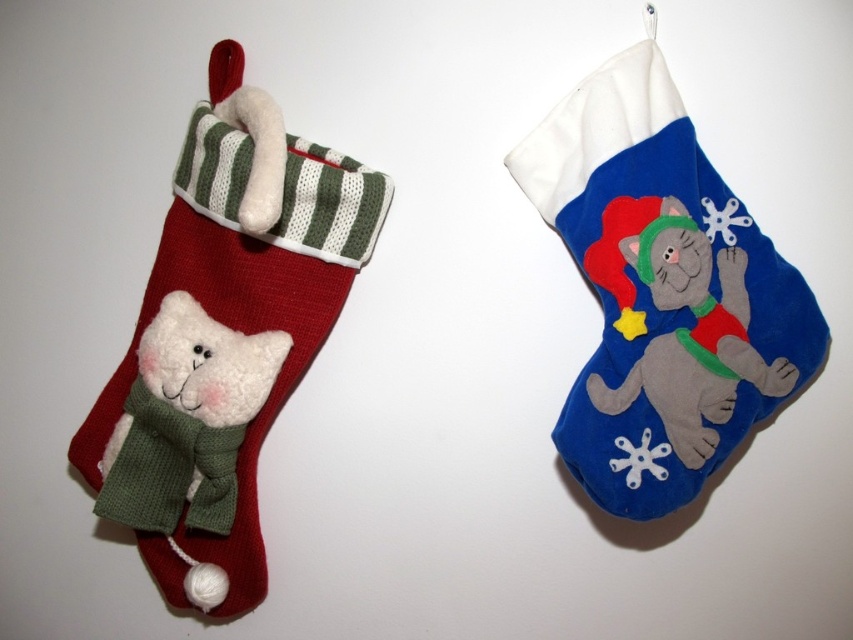
You are organizing a Christmas display and need to ensure there is enough space between the knitted woolen cat at left and the white fluffy teddy at left to prevent them from touching. If your minimum required spacing is 2 inches, will they touch each other?

The knitted woolen cat at left is 1.73 inches away from the white fluffy teddy at left. Since the required spacing is 2 inches, the distance between them is insufficient, so they will touch each other.

You are organizing a Christmas display and want to place a small ornament between the knitted woolen cat at left and the white fluffy teddy at left. Can you do this without moving either of them?

The white fluffy teddy at left is behind the knitted woolen cat at left, so there is no space between them for placing an ornament without moving either object.

You are a tailor who needs to place a decorative button exactly at point (225, 336) on the knitted woolen cat at left. Which part of the cat would this button be placed on?

The point (225, 336) is on the knitted woolen cat at left, so the decorative button would be placed on the cat.